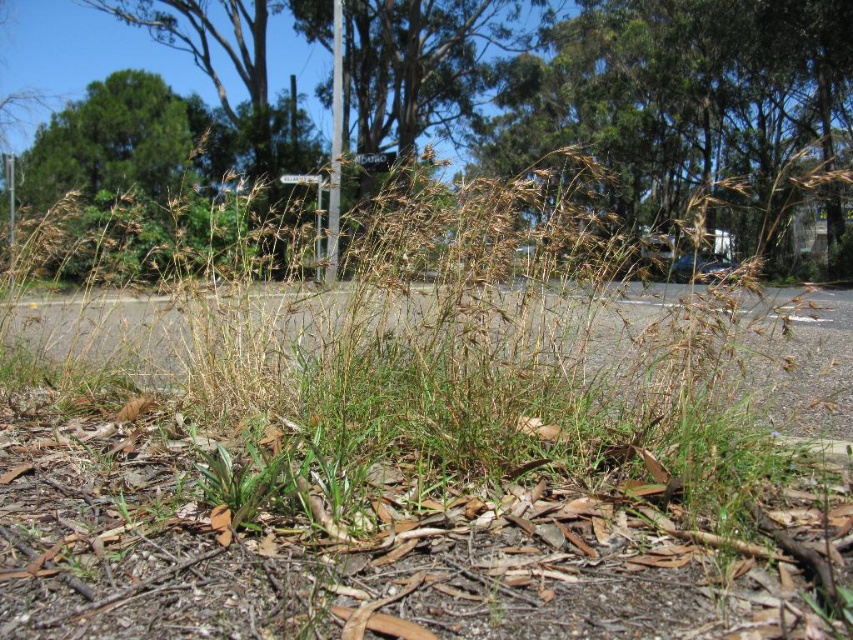
You are a hiker standing on the paved road and looking towards the green leafy tree at upper center and the metallic pole at center. Which object is closer to you?

The green leafy tree at upper center is closer to you because it is in front of the metallic pole at center.

You are standing on the road and looking towards the green leafy tree at upper center and the brown grass at upper center. Which object is nearer to you?

The green leafy tree at upper center is closer to the viewer than the brown grass at upper center.